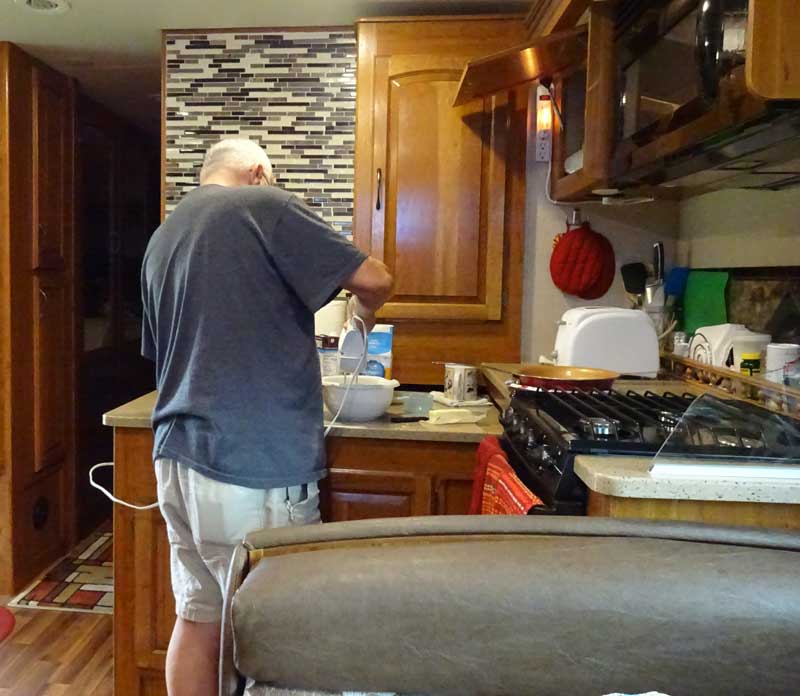
Locate an element on the screen. marble is located at coordinates (757, 305).